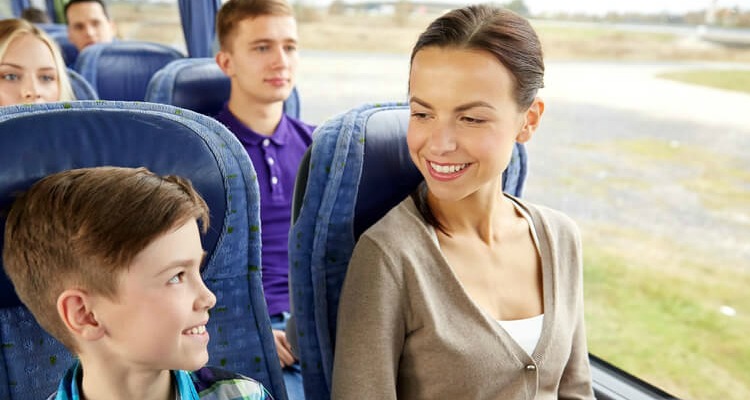
This screenshot has width=750, height=400. I want to click on seat, so click(x=66, y=45), click(x=78, y=88), click(x=118, y=74), click(x=121, y=139), click(x=206, y=82), click(x=357, y=148).